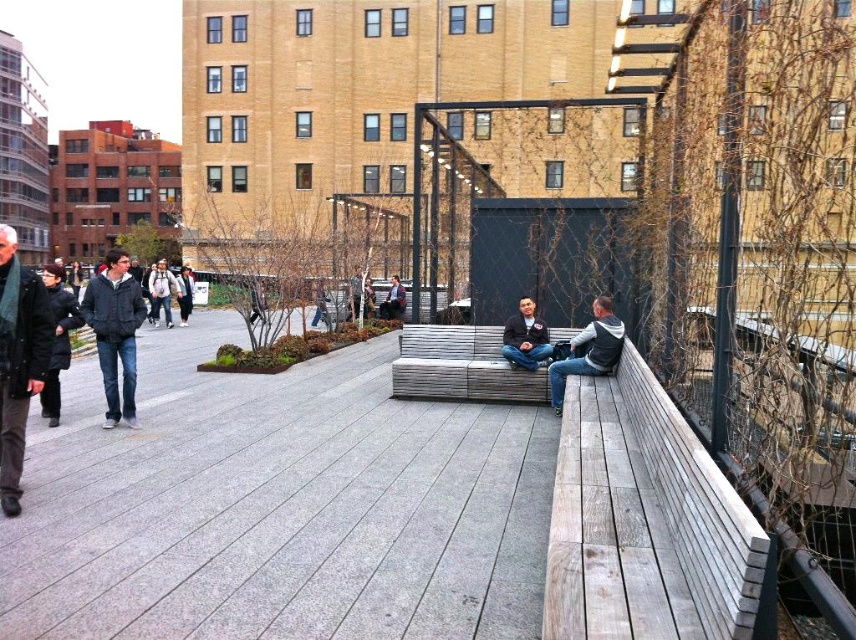
Is the position of dark gray wool jacket at left less distant than that of dark gray jacket at left?

Yes.

Does dark gray wool jacket at left appear on the left side of dark gray jacket at left?

Incorrect, dark gray wool jacket at left is not on the left side of dark gray jacket at left.

Identify the location of dark gray wool jacket at left. (18, 360).

This screenshot has height=640, width=856. I want to click on dark gray wool jacket at left, so click(18, 360).

Who is positioned more to the left, black wool coat at left or white cotton jacket at center?

white cotton jacket at center is more to the left.

Between point (58, 376) and point (183, 310), which one is positioned behind?

Point (183, 310)

Is point (52, 378) closer to viewer compared to point (186, 275)?

Yes, point (52, 378) is closer to viewer.

This screenshot has height=640, width=856. Find the location of `black wool coat at left`. black wool coat at left is located at coordinates (57, 339).

Is dark gray jacket at left further to camera compared to black wool coat at left?

Yes, dark gray jacket at left is behind black wool coat at left.

Which is behind, point (129, 346) or point (64, 337)?

Positioned behind is point (64, 337).

Find the location of a particular element. dark gray jacket at left is located at coordinates (116, 332).